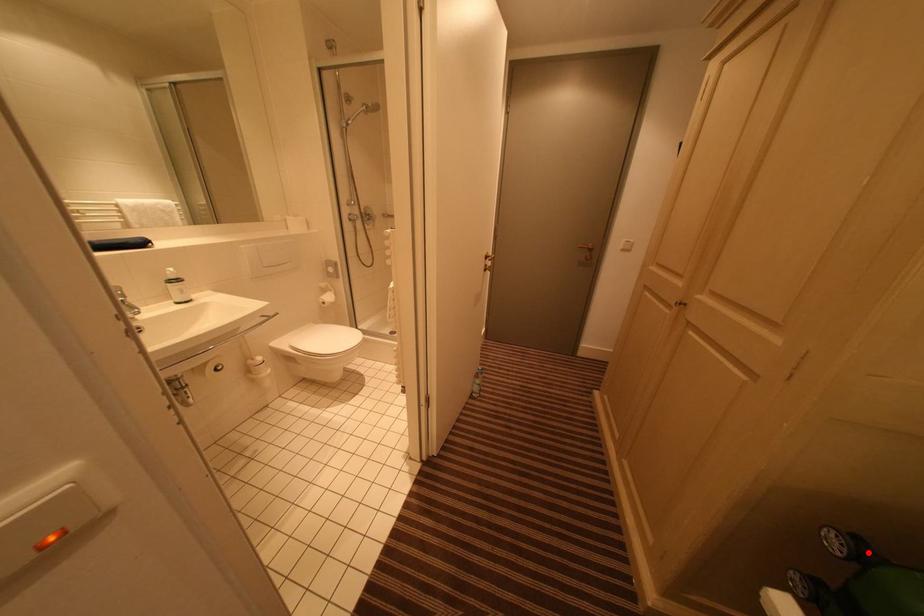
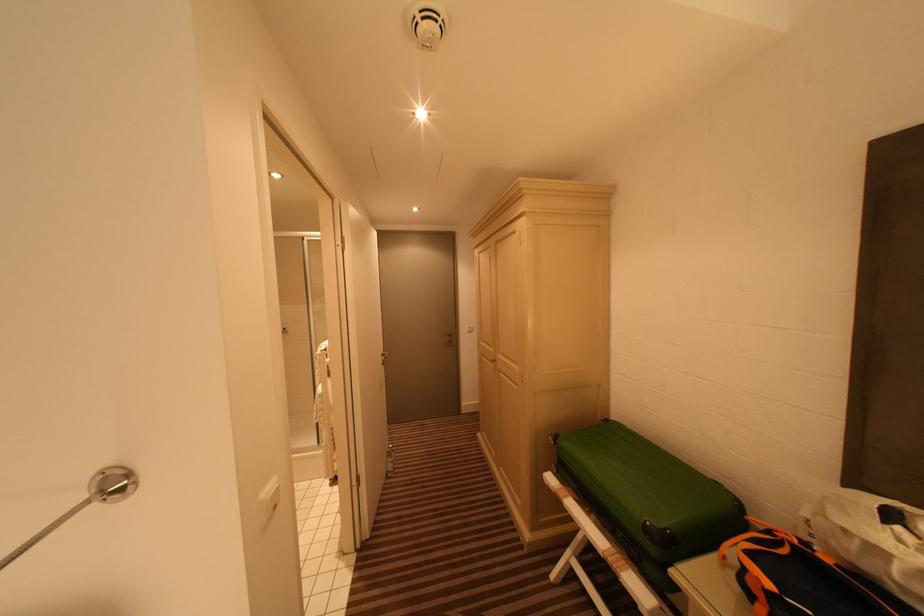
The point at the highlighted location is marked in the first image. Where is the corresponding point in the second image?

(563, 440)